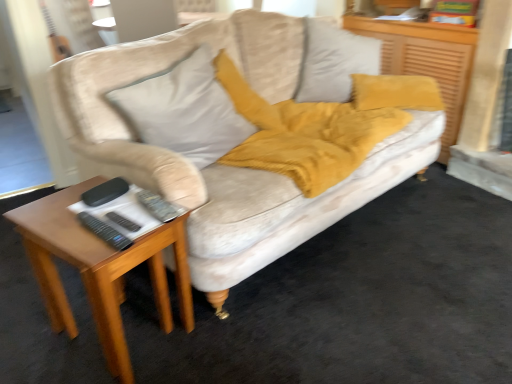
Question: From the image's perspective, is woodenmaterial/texturetable at left beneath velvet mustard pillow at upper right?

Choices:
 (A) no
 (B) yes

Answer: (B)

Question: Does woodenmaterial/texturetable at left have a greater width compared to velvet mustard pillow at upper right?

Choices:
 (A) no
 (B) yes

Answer: (B)

Question: Is woodenmaterial/texturetable at left facing away from velvet mustard pillow at upper right?

Choices:
 (A) no
 (B) yes

Answer: (A)

Question: Is woodenmaterial/texturetable at left far away from velvet mustard pillow at upper right?

Choices:
 (A) no
 (B) yes

Answer: (B)

Question: Considering the relative sizes of woodenmaterial/texturetable at left and velvet mustard pillow at upper right in the image provided, is woodenmaterial/texturetable at left taller than velvet mustard pillow at upper right?

Choices:
 (A) yes
 (B) no

Answer: (B)

Question: Do you think black plastic remote at lower left, the 1th remote when ordered from back to front, is within woodenmaterial/texturetable at left, or outside of it?

Choices:
 (A) outside
 (B) inside

Answer: (B)

Question: In terms of size, does black plastic remote at lower left, the 2th remote from the front, appear bigger or smaller than woodenmaterial/texturetable at left?

Choices:
 (A) small
 (B) big

Answer: (A)

Question: In the image, is black plastic remote at lower left, the 1th remote when ordered from back to front, on the left side or the right side of woodenmaterial/texturetable at left?

Choices:
 (A) right
 (B) left

Answer: (A)

Question: In terms of height, does black plastic remote at lower left, the 1th remote when ordered from back to front, look taller or shorter compared to woodenmaterial/texturetable at left?

Choices:
 (A) short
 (B) tall

Answer: (A)

Question: Considering the positions of black plastic remote at lower left, which is counted as the first remote, starting from the front, and woodenmaterial/texturetable at left in the image, is black plastic remote at lower left, which is counted as the first remote, starting from the front, bigger or smaller than woodenmaterial/texturetable at left?

Choices:
 (A) big
 (B) small

Answer: (B)

Question: From the image's perspective, is black plastic remote at lower left, which is the 2th remote in back-to-front order, located above or below woodenmaterial/texturetable at left?

Choices:
 (A) below
 (B) above

Answer: (B)

Question: Is point (120, 241) positioned closer to the camera than point (42, 210)?

Choices:
 (A) farther
 (B) closer

Answer: (B)

Question: Is black plastic remote at lower left, which is the 2th remote in back-to-front order, wider or thinner than woodenmaterial/texturetable at left?

Choices:
 (A) wide
 (B) thin

Answer: (B)

Question: From the image's perspective, is velvet gray pillow at upper center located above or below woodenmaterial/texturetable at left?

Choices:
 (A) above
 (B) below

Answer: (A)

Question: Looking at their shapes, would you say velvet gray pillow at upper center is wider or thinner than woodenmaterial/texturetable at left?

Choices:
 (A) wide
 (B) thin

Answer: (A)